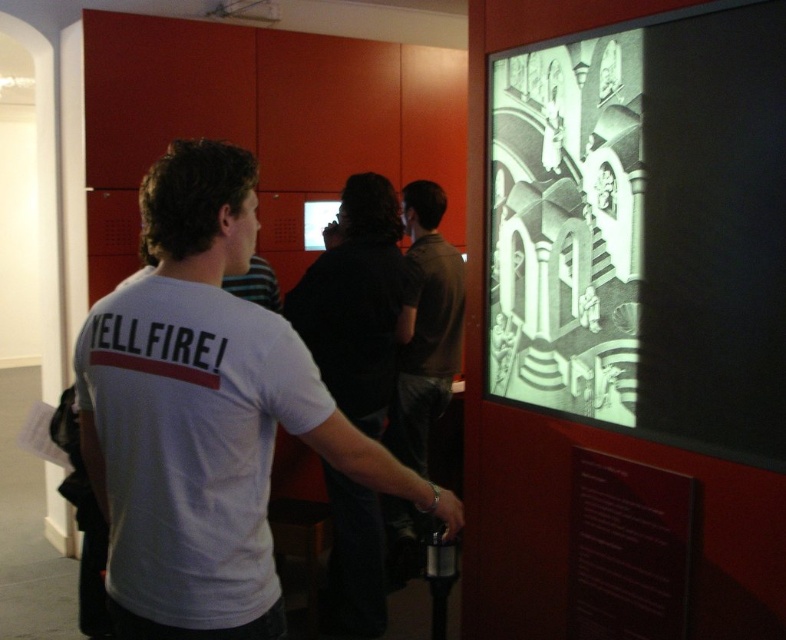
You are a visitor in the exhibition space. You see a monochrome paper artwork at center and a dark brown shirt at center. Which object is positioned higher in the scene?

The monochrome paper artwork at center is located above the dark brown shirt at center, so it is positioned higher in the scene.